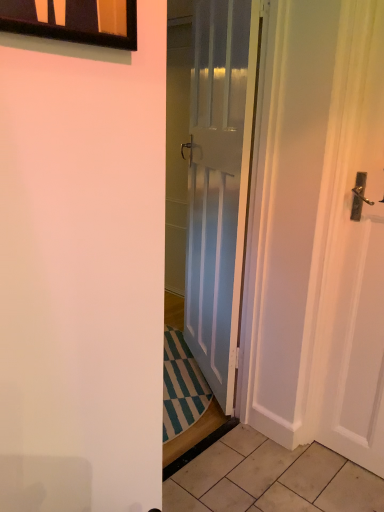
Identify the location of empty space that is ontop of beige tile at lower right. (337, 482).